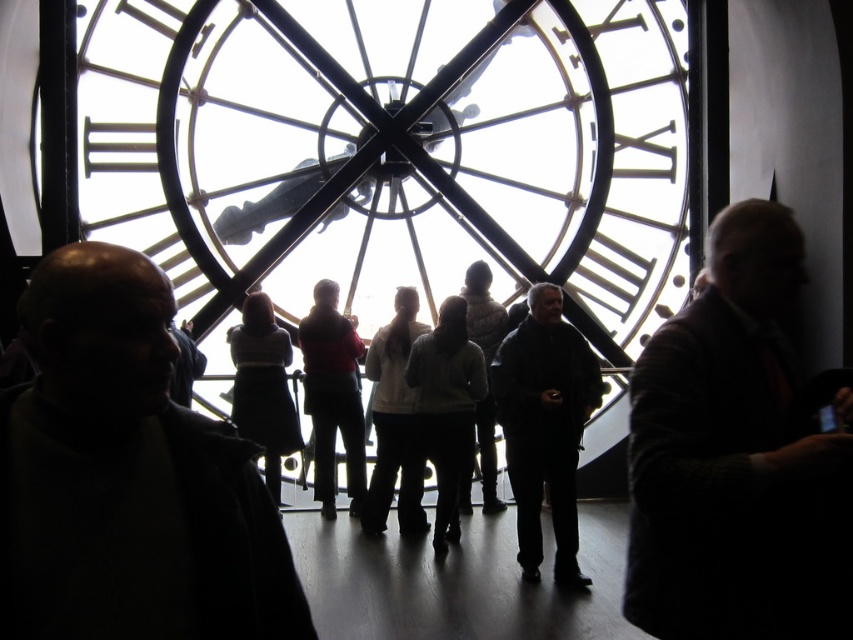
Can you confirm if dark gray suit at right is positioned above light brown leather jacket at center?

No, dark gray suit at right is not above light brown leather jacket at center.

Find the location of `dark gray suit at right`. dark gray suit at right is located at coordinates (738, 456).

The width and height of the screenshot is (853, 640). Find the location of `dark gray suit at right`. dark gray suit at right is located at coordinates (738, 456).

Which is more to the left, dark matte coat at center or light gray sweater at center?

From the viewer's perspective, light gray sweater at center appears more on the left side.

The width and height of the screenshot is (853, 640). Describe the element at coordinates (544, 426) in the screenshot. I see `dark matte coat at center` at that location.

The height and width of the screenshot is (640, 853). I want to click on dark matte coat at center, so click(x=544, y=426).

Is transparent glass clock at center above dark gray suit at right?

Yes, transparent glass clock at center is above dark gray suit at right.

This screenshot has width=853, height=640. What are the coordinates of `transparent glass clock at center` in the screenshot? It's located at (387, 148).

I want to click on transparent glass clock at center, so click(x=387, y=148).